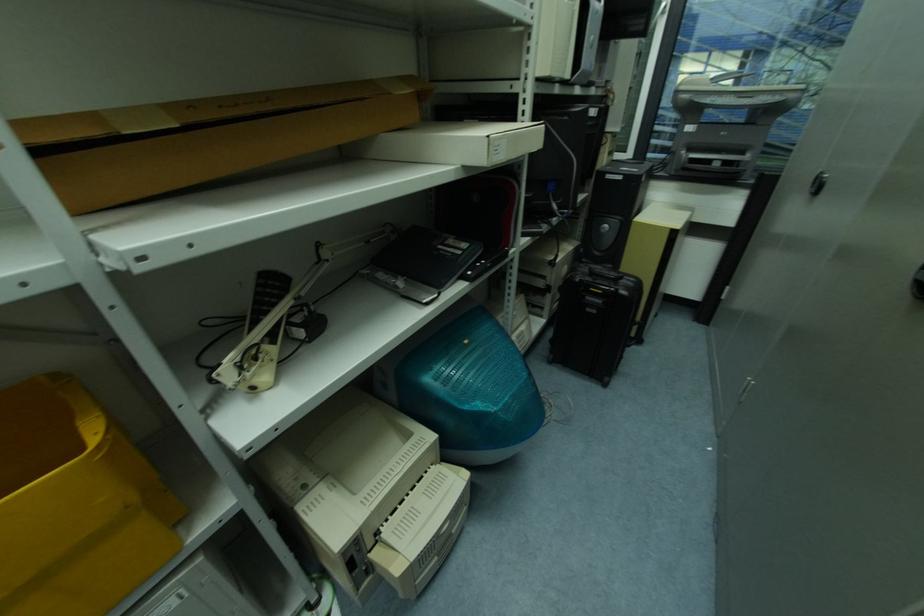
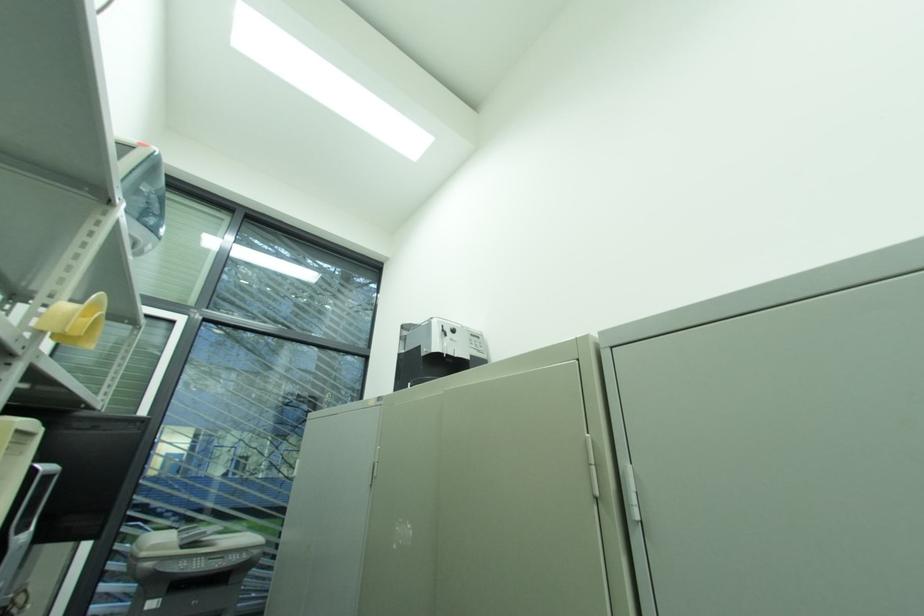
The first image is from the beginning of the video and the second image is from the end. How did the camera likely rotate when shooting the video?

The rotation direction of the camera is right-up.